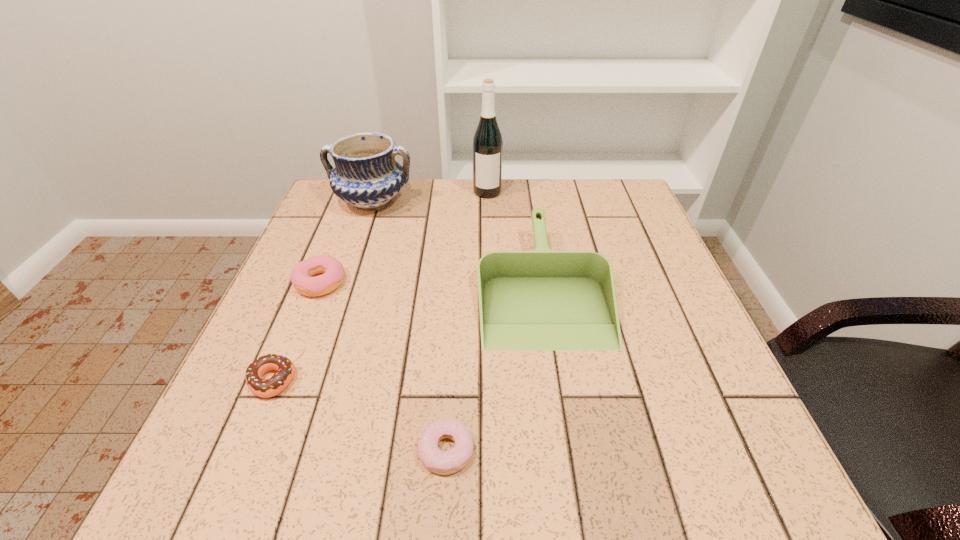
This screenshot has width=960, height=540. Identify the location of wine bottle. (487, 142).

Find the location of a particular element. the second tallest object is located at coordinates (366, 175).

This screenshot has width=960, height=540. I want to click on the third tallest object, so click(x=542, y=299).

This screenshot has width=960, height=540. I want to click on the third shortest object, so click(x=301, y=277).

This screenshot has height=540, width=960. I want to click on the farthest doughnut, so click(x=301, y=277).

What are the coordinates of `the fifth farthest object` in the screenshot? It's located at (285, 367).

Find the location of a particular element. the nearest doughnut is located at coordinates (437, 461).

This screenshot has width=960, height=540. What are the coordinates of `the shortest doughnut` in the screenshot? It's located at (437, 461).

Locate an element on the screen. This screenshot has width=960, height=540. vacant space located on the label of the tallest object is located at coordinates (489, 253).

You are a GUI agent. You are given a task and a screenshot of the screen. Output one action in this format:
    pyautogui.click(x=<x>, y=<y>)
    Task: Click on the vacant space located on the front of the fifth shortest object
    The width and height of the screenshot is (960, 540).
    Given the screenshot: What is the action you would take?
    pyautogui.click(x=351, y=264)